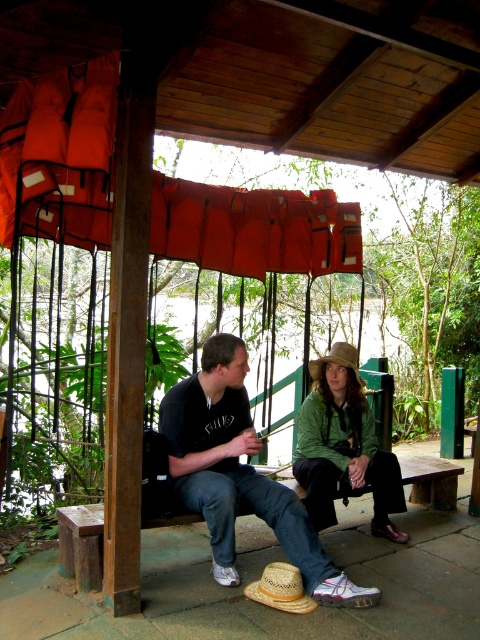
Question: Does green matte jacket at center appear over strawmaterial/texturehat at lower center?

Choices:
 (A) yes
 (B) no

Answer: (A)

Question: Observing the image, what is the correct spatial positioning of green matte jacket at center in reference to strawmaterial/texturehat at center?

Choices:
 (A) above
 (B) below

Answer: (B)

Question: Which point is farther from the camera taking this photo?

Choices:
 (A) (239, 506)
 (B) (360, 401)
 (C) (315, 365)
 (D) (344, 518)

Answer: (D)

Question: Which point is farther from the camera taking this photo?

Choices:
 (A) (94, 588)
 (B) (354, 362)
 (C) (379, 458)
 (D) (289, 566)

Answer: (B)

Question: Which object is the farthest from the strawmaterial/texturehat at lower center?

Choices:
 (A) green matte jacket at center
 (B) matte black shirt at center
 (C) wooden bench at center
 (D) strawmaterial/texturehat at center

Answer: (D)

Question: Does matte black shirt at center lie in front of strawmaterial/texturehat at lower center?

Choices:
 (A) no
 (B) yes

Answer: (A)